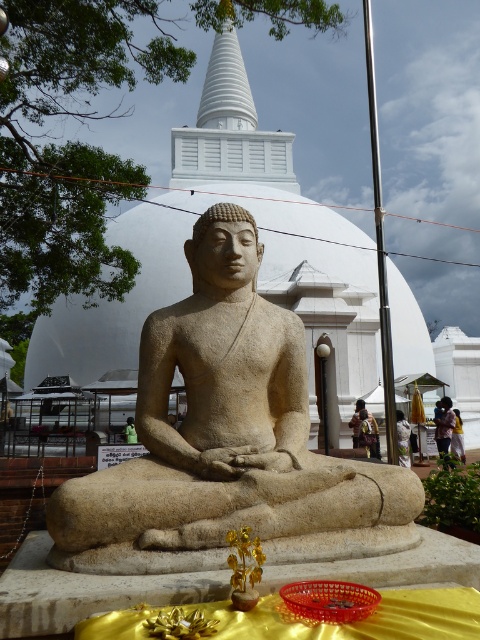
You are standing in front of the large stone statue of a seated figure. You need to place a small golden plant and a red basket in front of the statue. Where exactly should you place them relative to the yellow fabric at center?

The small golden plant and red basket should be placed in front of the large stone statue of a seated figure, which is located at the yellow fabric at center positioned at coordinates point (x=369, y=433).

You are a visitor at the site and want to place a new offering in front of the beige stone statue at center. However, there is already a yellow fabric dress at center in the way. Can you place your offering directly in front of the statue without moving the dress?

The beige stone statue at center is positioned over the yellow fabric dress at center, meaning the dress is located beneath the statue. Since the dress is already under the statue, you can place your offering directly in front of the statue without needing to move the dress as there is space in front.